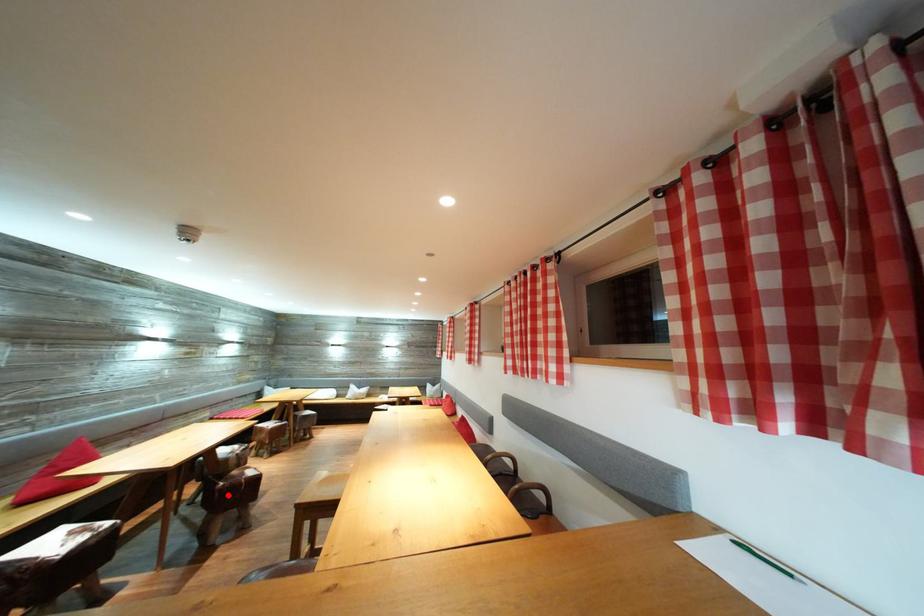
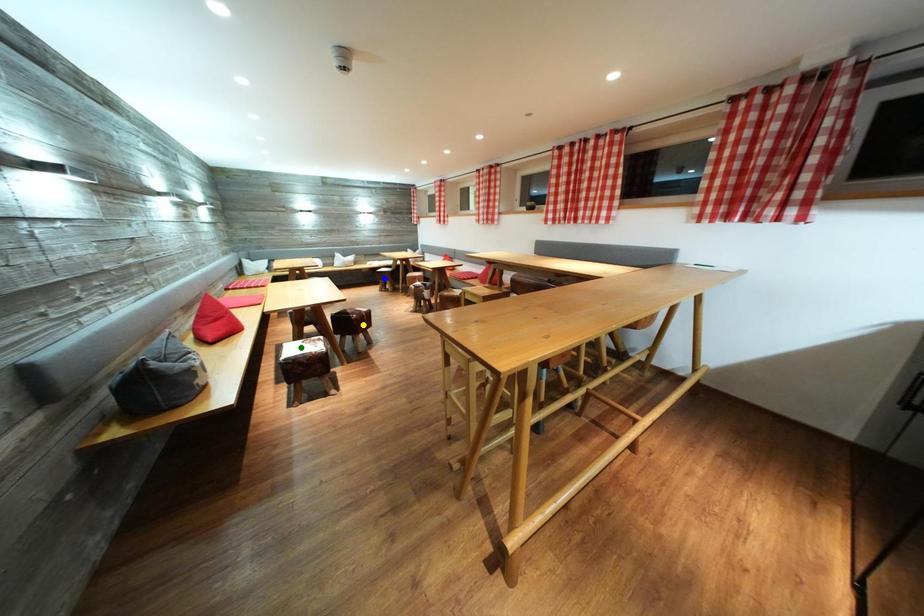
Question: I am providing you with two images of the same scene from different viewpoints. A red point is marked on the first image. You are given multiple points on the second image. In image 2, which mark is for the same physical point as the one in image 1?

Choices:
 (A) yellow point
 (B) blue point
 (C) green point

Answer: (A)